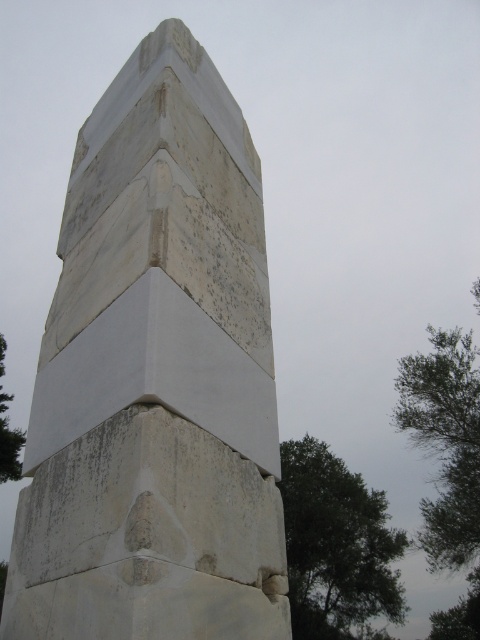
Question: Observing the image, what is the correct spatial positioning of white stone monument at center in reference to green leafy tree at right?

Choices:
 (A) right
 (B) left

Answer: (B)

Question: Which point appears farthest from the camera in this image?

Choices:
 (A) click(188, 246)
 (B) click(12, 435)

Answer: (B)

Question: Is green leafy tree at right positioned at the back of green leafy tree at lower left?

Choices:
 (A) no
 (B) yes

Answer: (A)

Question: Can you confirm if green leafy tree at upper right is bigger than green leafy tree at lower left?

Choices:
 (A) no
 (B) yes

Answer: (B)

Question: Which point appears farthest from the camera in this image?

Choices:
 (A) (45, 337)
 (B) (3, 472)
 (C) (303, 621)

Answer: (C)

Question: Which point appears farthest from the camera in this image?

Choices:
 (A) (300, 627)
 (B) (465, 422)

Answer: (A)